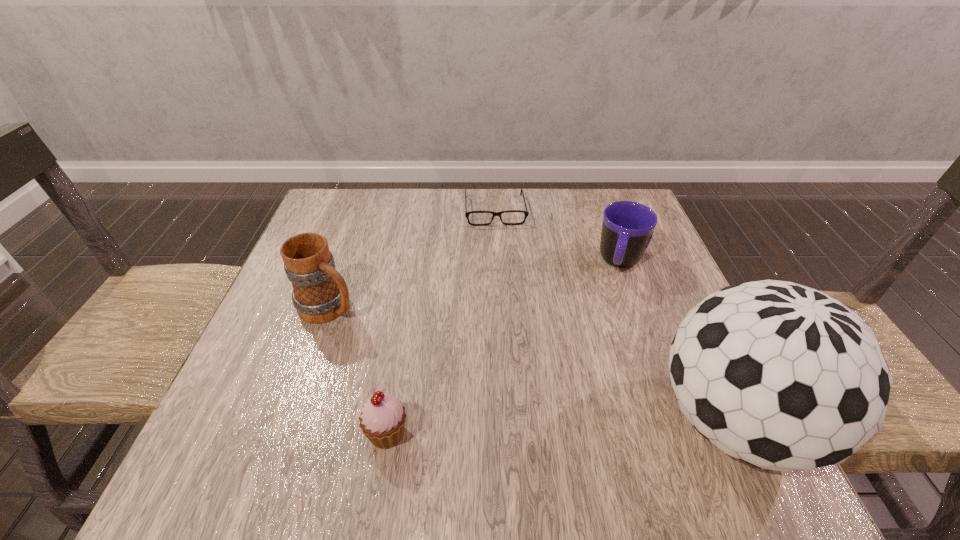
At what (x,y) coordinates should I click in order to perform the action: click on empty location between the shortest object and the tallest object. Please return your answer as a coordinate pair (x, y). This screenshot has width=960, height=540. Looking at the image, I should click on (614, 315).

This screenshot has height=540, width=960. Identify the location of unoccupied area between the second object from left to right and the shorter mug. (504, 348).

Image resolution: width=960 pixels, height=540 pixels. Find the location of `free space between the shortest object and the fourth shortest object`. free space between the shortest object and the fourth shortest object is located at coordinates (413, 258).

Identify which object is the second nearest to the farther mug. Please provide its 2D coordinates. Your answer should be formatted as a tuple, i.e. [(x, y)], where the tuple contains the x and y coordinates of a point satisfying the conditions above.

[(781, 376)]

I want to click on the closest object relative to the third object from left to right, so pyautogui.click(x=627, y=229).

Locate an element on the screen. The width and height of the screenshot is (960, 540). free point that satisfies the following two spatial constraints: 1. on the back side of the fourth nearest object; 2. on the right side of the fourth shortest object is located at coordinates [345, 262].

Identify the location of free location that satisfies the following two spatial constraints: 1. on the front side of the nearer mug; 2. on the left side of the fourth object from right to left. The image size is (960, 540). (285, 434).